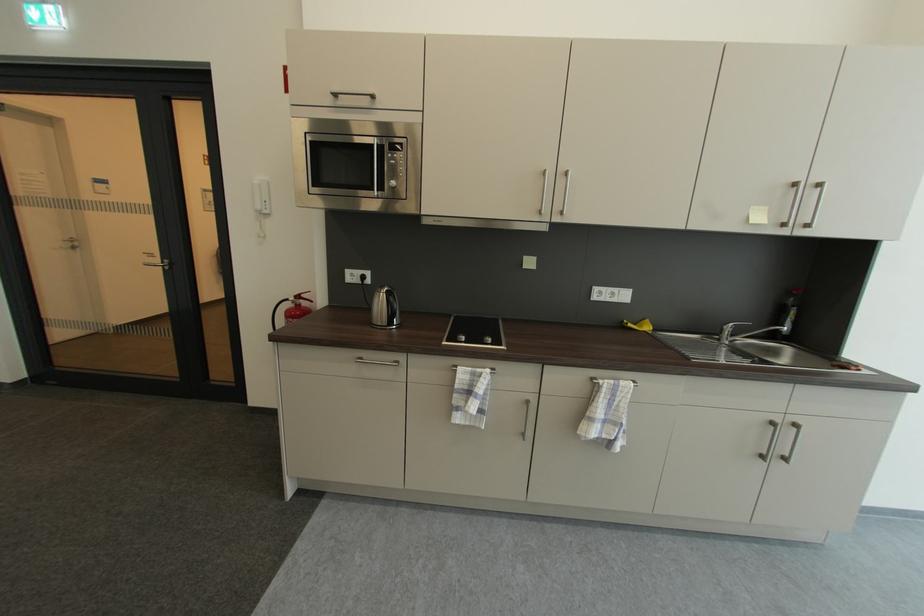
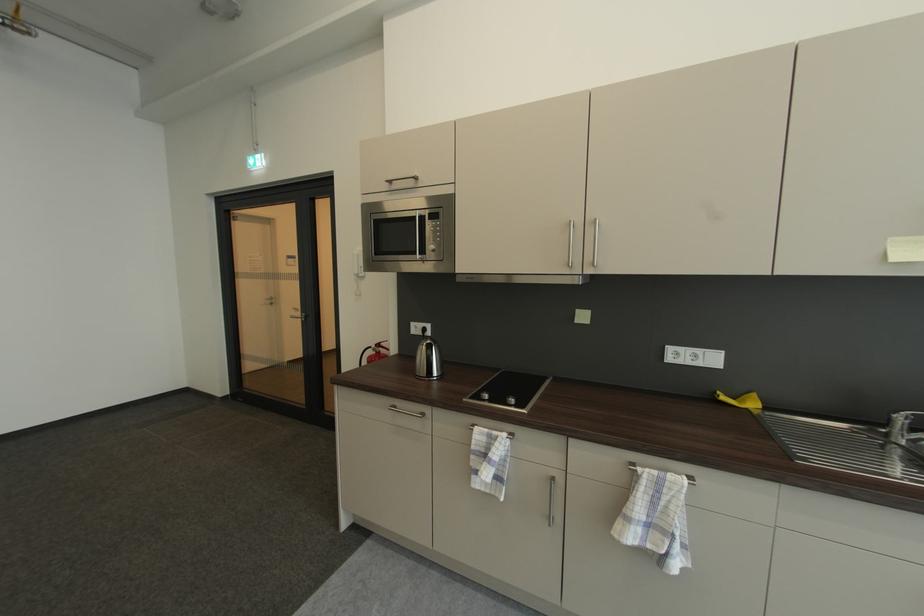
Where in the second image is the point corresponding to (458,341) from the first image?

(483, 398)